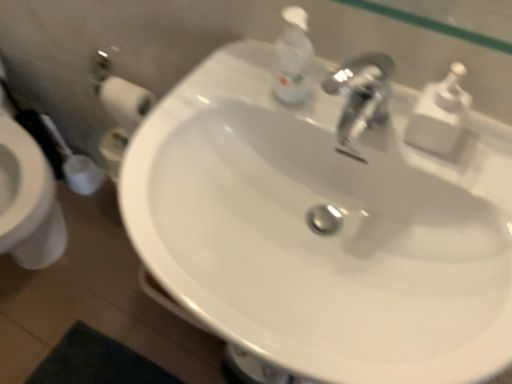
Question: From the image's perspective, is white plastic soap dispenser at upper center, the 2th soap dispenser in the right-to-left sequence, on white glossy sink at center?

Choices:
 (A) no
 (B) yes

Answer: (B)

Question: Is white plastic soap dispenser at upper center, the 2th soap dispenser in the right-to-left sequence, facing away from white glossy sink at center?

Choices:
 (A) no
 (B) yes

Answer: (A)

Question: Considering the relative sizes of white plastic soap dispenser at upper center, the first soap dispenser from the left, and white glossy sink at center in the image provided, is white plastic soap dispenser at upper center, the first soap dispenser from the left, bigger than white glossy sink at center?

Choices:
 (A) yes
 (B) no

Answer: (B)

Question: Is white plastic soap dispenser at upper center, the first soap dispenser from the left, next to white glossy sink at center and touching it?

Choices:
 (A) no
 (B) yes

Answer: (A)

Question: Is white plastic soap dispenser at upper center, the first soap dispenser from the left, in front of white glossy sink at center?

Choices:
 (A) no
 (B) yes

Answer: (A)

Question: Can you confirm if white plastic soap dispenser at upper center, the first soap dispenser from the left, is wider than white glossy sink at center?

Choices:
 (A) yes
 (B) no

Answer: (B)

Question: Is white plastic soap dispenser at upper center, the first soap dispenser from the left, oriented towards white plastic soap dispenser at upper right, which is the 1th soap dispenser in right-to-left order?

Choices:
 (A) yes
 (B) no

Answer: (B)

Question: Is the position of white plastic soap dispenser at upper center, the 2th soap dispenser in the right-to-left sequence, less distant than that of white plastic soap dispenser at upper right, which is the 1th soap dispenser in right-to-left order?

Choices:
 (A) yes
 (B) no

Answer: (B)

Question: Is white plastic soap dispenser at upper center, the first soap dispenser from the left, smaller than white plastic soap dispenser at upper right, which is the 1th soap dispenser in right-to-left order?

Choices:
 (A) no
 (B) yes

Answer: (B)

Question: Does white plastic soap dispenser at upper center, the 2th soap dispenser in the right-to-left sequence, have a lesser width compared to white plastic soap dispenser at upper right, the second soap dispenser in the left-to-right sequence?

Choices:
 (A) no
 (B) yes

Answer: (B)

Question: From the image's perspective, is white plastic soap dispenser at upper center, the first soap dispenser from the left, under white plastic soap dispenser at upper right, the second soap dispenser in the left-to-right sequence?

Choices:
 (A) no
 (B) yes

Answer: (A)

Question: Is white plastic soap dispenser at upper center, the first soap dispenser from the left, shorter than white plastic soap dispenser at upper right, the second soap dispenser in the left-to-right sequence?

Choices:
 (A) no
 (B) yes

Answer: (A)

Question: Considering the relative sizes of white glossy sink at center and white plastic soap dispenser at upper right, the second soap dispenser in the left-to-right sequence, in the image provided, is white glossy sink at center wider than white plastic soap dispenser at upper right, the second soap dispenser in the left-to-right sequence,?

Choices:
 (A) yes
 (B) no

Answer: (A)